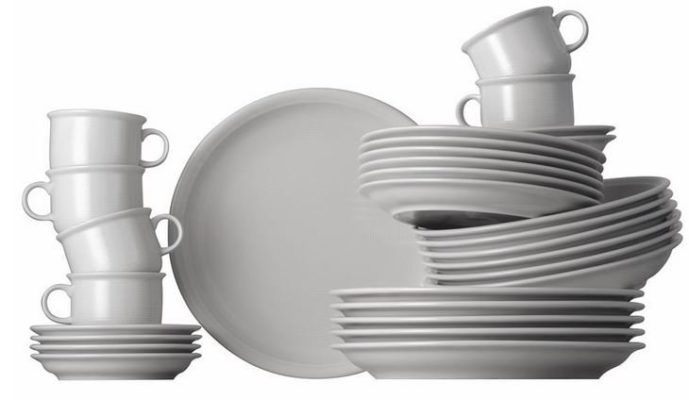
Find the location of `cups`. cups is located at coordinates (83, 142), (82, 206), (103, 245), (506, 105), (523, 52), (111, 301).